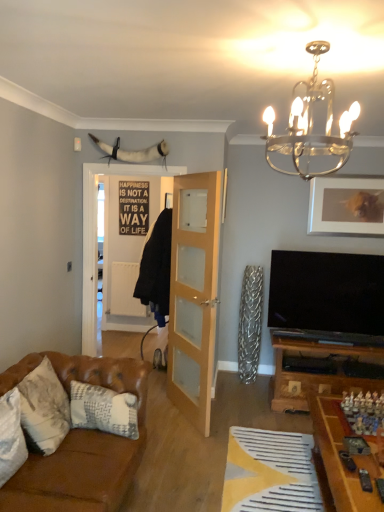
Locate an element on the screen. The height and width of the screenshot is (512, 384). free point in front of clear glass door at center is located at coordinates (180, 440).